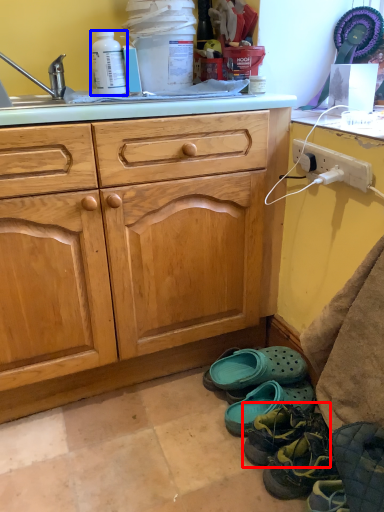
Question: Among these objects, which one is nearest to the camera, footwear (highlighted by a red box) or bottle (highlighted by a blue box)?

Choices:
 (A) footwear
 (B) bottle

Answer: (A)